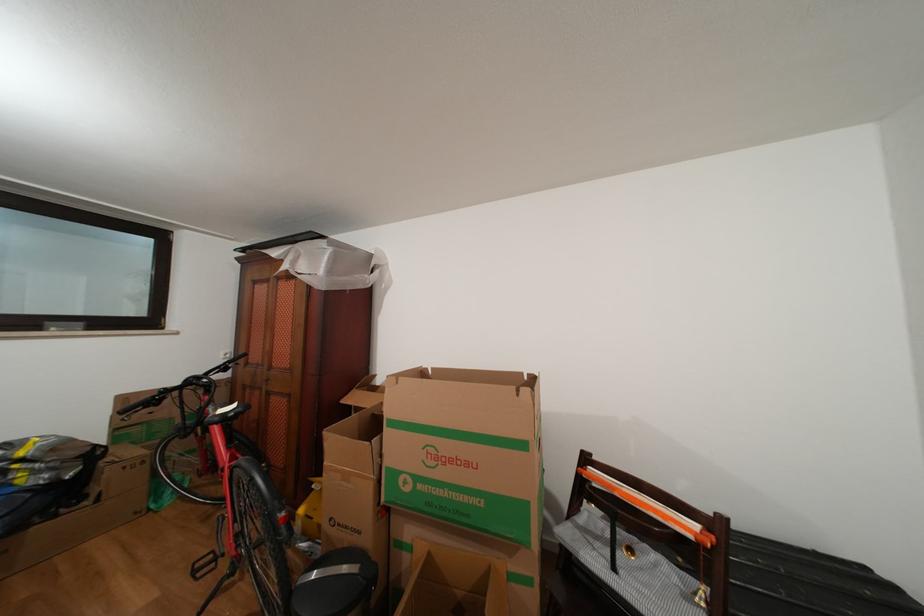
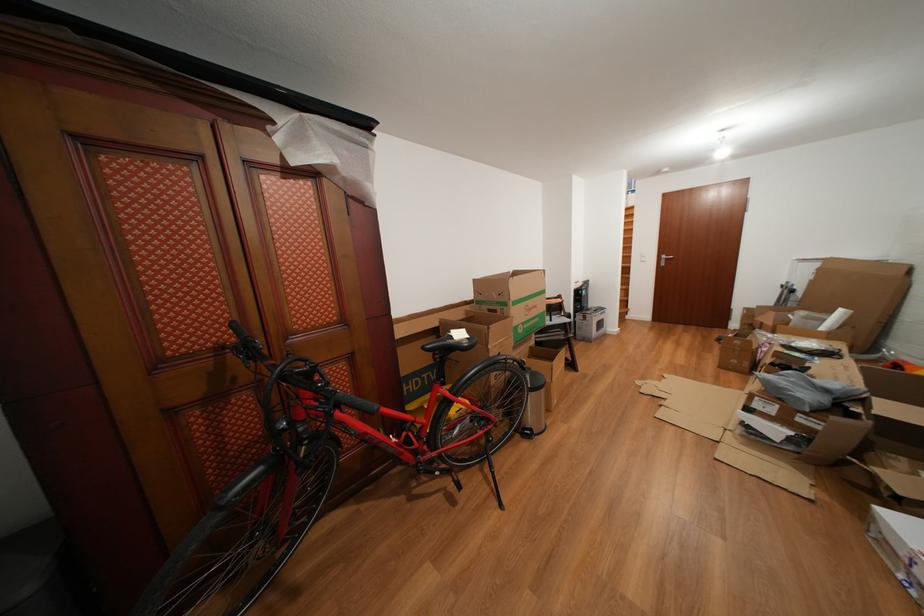
Locate, in the second image, the point that corresponds to point 476,469 in the first image.

(543, 312)